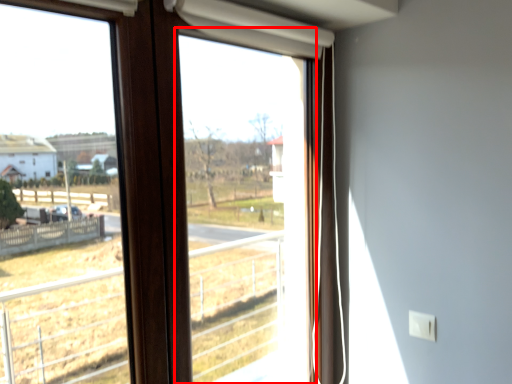
Question: From the image's perspective, what is the correct spatial positioning of window screen (annotated by the red box) in reference to window?

Choices:
 (A) above
 (B) below

Answer: (A)